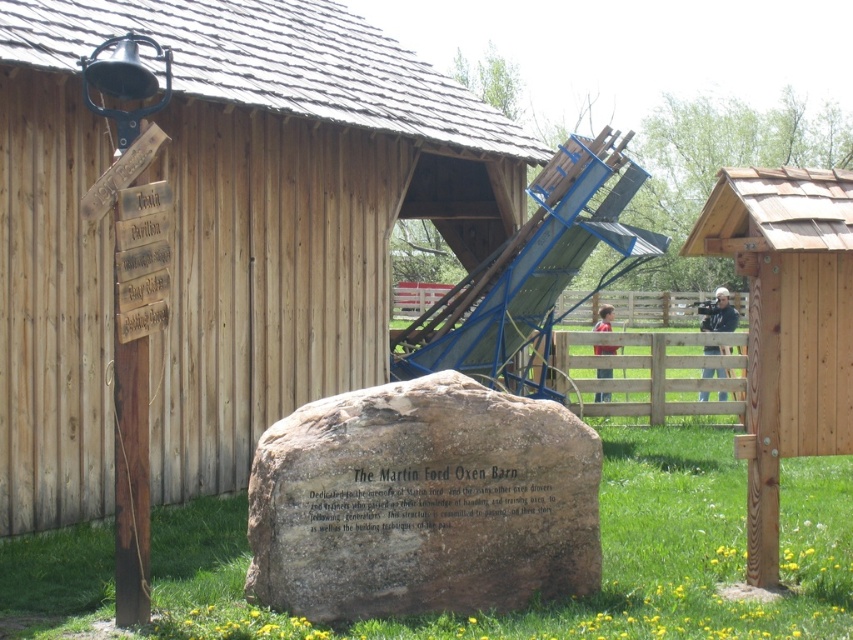
Question: Which of the following is the farthest from the observer?

Choices:
 (A) (213, 230)
 (B) (332, 465)
 (C) (585, 317)
 (D) (764, 349)

Answer: (C)

Question: In this image, where is green grass at center located relative to wooden post at right?

Choices:
 (A) below
 (B) above

Answer: (A)

Question: Which object is the closest to the brown rough stone at center?

Choices:
 (A) green grass at center
 (B) wooden hut at center
 (C) wooden at center
 (D) wooden post at right

Answer: (A)

Question: Which point is farther from the camera taking this photo?

Choices:
 (A) (555, 310)
 (B) (677, 365)
 (C) (213, 580)

Answer: (A)

Question: Is green grass at center further to camera compared to wooden post at right?

Choices:
 (A) yes
 (B) no

Answer: (B)

Question: Where is green grass at center located in relation to brown rough stone at center in the image?

Choices:
 (A) right
 (B) left

Answer: (A)